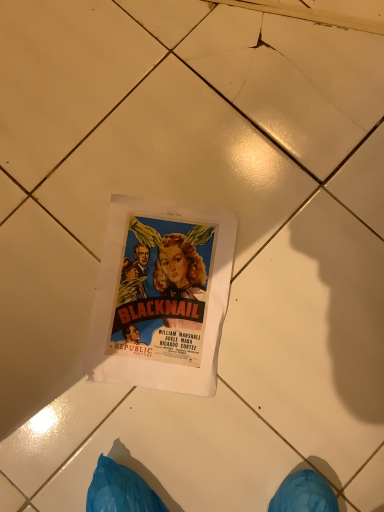
Image resolution: width=384 pixels, height=512 pixels. What are the coordinates of `free space above matte paper poster at center (from a real-world perspective)` in the screenshot? It's located at (162, 300).